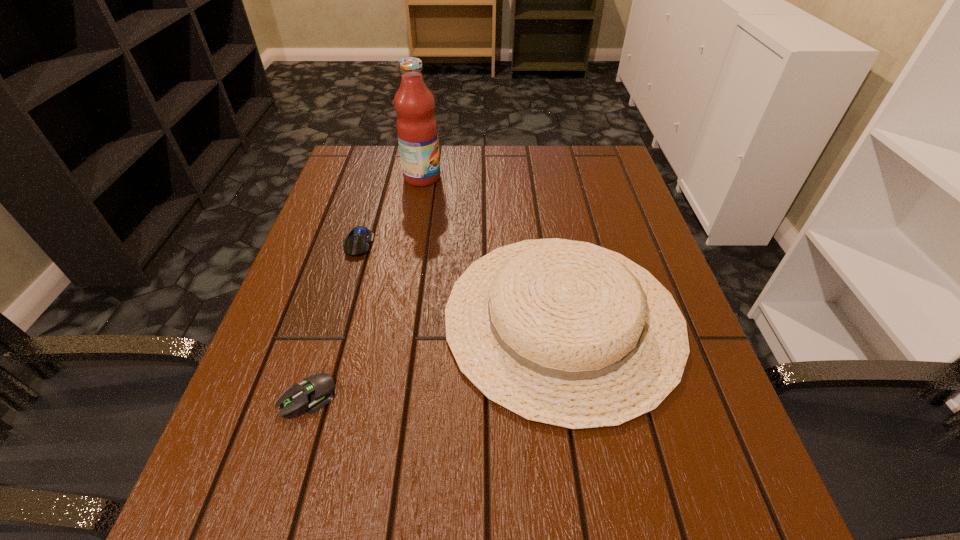
At what (x,y) coordinates should I click in order to perform the action: click on the tallest object. Please return your answer as a coordinate pair (x, y). The height and width of the screenshot is (540, 960). Looking at the image, I should click on (417, 131).

At what (x,y) coordinates should I click in order to perform the action: click on fruit juice. Please return your answer as a coordinate pair (x, y). The height and width of the screenshot is (540, 960). Looking at the image, I should click on (417, 131).

You are a GUI agent. You are given a task and a screenshot of the screen. Output one action in this format:
    pyautogui.click(x=<x>, y=<y>)
    Task: Click on the third shortest object
    Image resolution: width=960 pixels, height=540 pixels.
    Given the screenshot: What is the action you would take?
    pyautogui.click(x=565, y=333)

I want to click on the rightmost object, so click(x=565, y=333).

I want to click on the farther computer mouse, so click(x=357, y=242).

In order to click on the nearer computer mouse in this screenshot , I will do `click(316, 391)`.

I want to click on vacant space located 0.240m on the front label of the tallest object, so click(531, 177).

Identify the location of vacant space located on the back of the second tallest object. (541, 195).

I want to click on vacant space located on the button side of the farther computer mouse, so click(x=340, y=304).

Where is `vacant space located on the front of the nearer computer mouse`? vacant space located on the front of the nearer computer mouse is located at coordinates (276, 503).